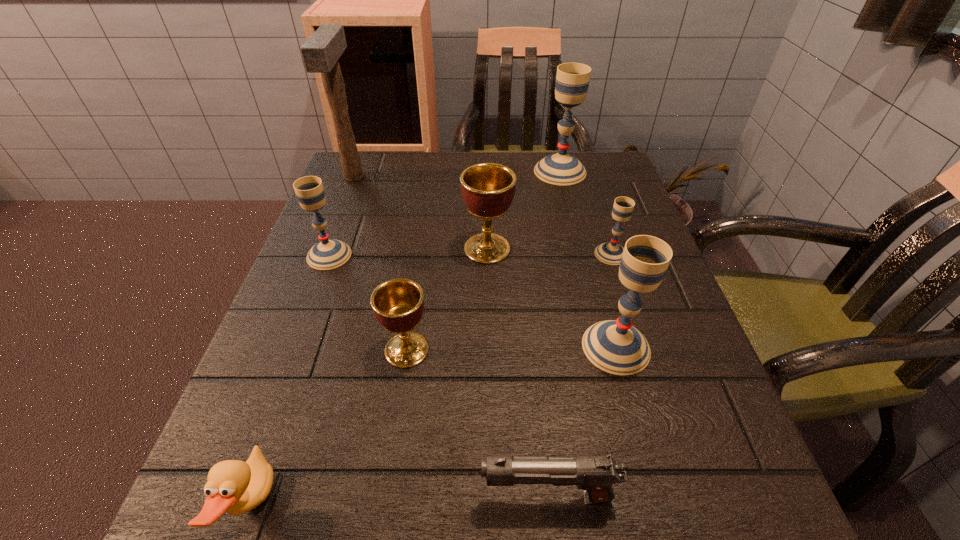
Identify the location of the nearer golden chalice. This screenshot has height=540, width=960. (398, 304).

Locate an element on the screen. the smallest gray chalice is located at coordinates (610, 253).

Find the location of a particular element. Image resolution: width=960 pixels, height=540 pixels. gray gun is located at coordinates 595,475.

Locate an element on the screen. The height and width of the screenshot is (540, 960). vacant space located on the front of the tallest object is located at coordinates (335, 226).

This screenshot has height=540, width=960. Find the location of `vacant space situated 0.060m on the left of the farthest chalice`. vacant space situated 0.060m on the left of the farthest chalice is located at coordinates (512, 171).

This screenshot has width=960, height=540. What are the coordinates of `vacant region located 0.310m on the left of the third tallest object` in the screenshot? It's located at (406, 347).

Identify the location of vacant space located 0.400m on the right of the leftmost chalice. (537, 255).

Where is `free spot located on the front of the third chalice from left to right`? free spot located on the front of the third chalice from left to right is located at coordinates (491, 426).

The height and width of the screenshot is (540, 960). Identify the location of vacant area situated 0.130m on the left of the sixth object from right to left. (308, 350).

The width and height of the screenshot is (960, 540). What are the coordinates of `free space located 0.070m on the left of the smallest gray chalice` in the screenshot? It's located at (563, 254).